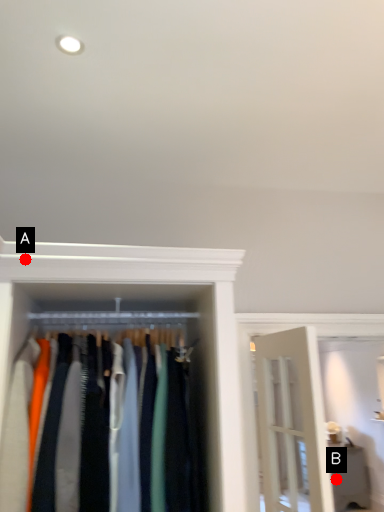
Question: Two points are circled on the image, labeled by A and B beside each circle. Which point appears closest to the camera in this image?

Choices:
 (A) A is closer
 (B) B is closer

Answer: (A)